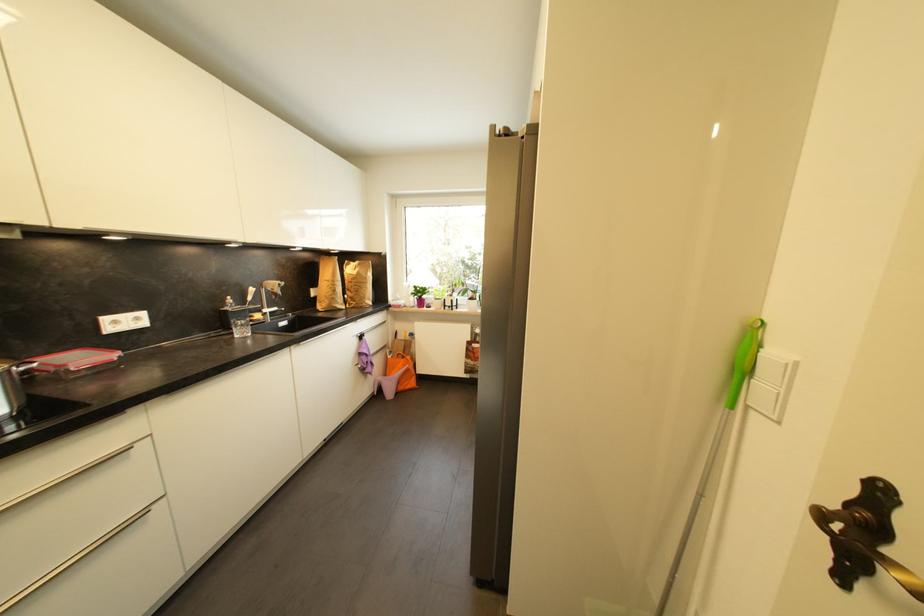
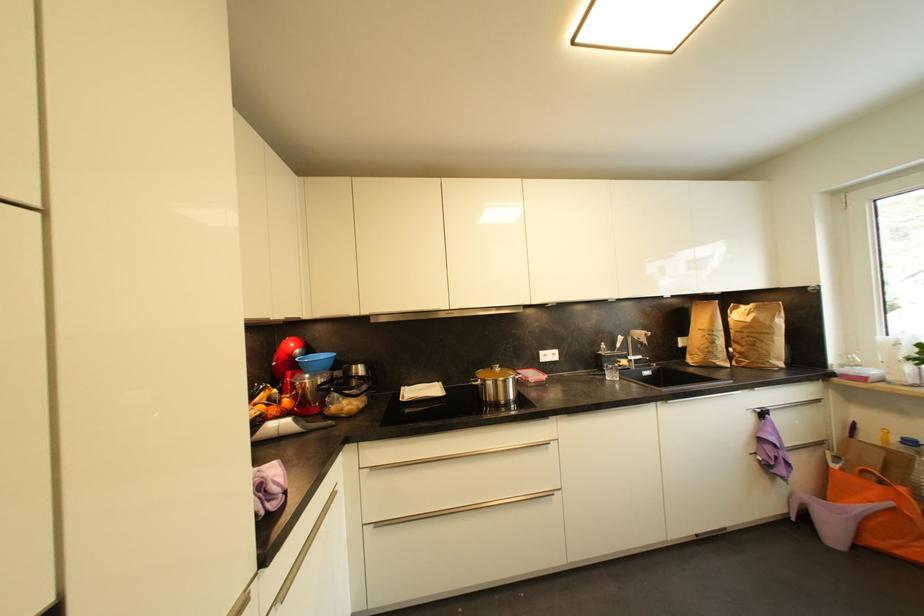
Locate, in the second image, the point that corresponds to [384,381] in the first image.

(811, 498)